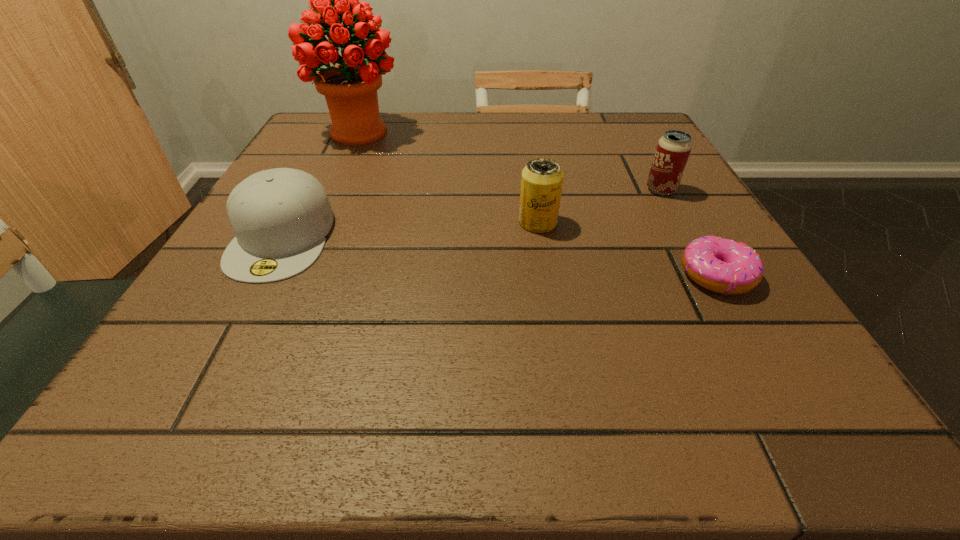
Locate an element on the screen. bouquet is located at coordinates (350, 89).

You are a GUI agent. You are given a task and a screenshot of the screen. Output one action in this format:
    pyautogui.click(x=<x>, y=<y>)
    Task: Click on the farthest object
    The image size is (960, 540).
    Given the screenshot: What is the action you would take?
    pyautogui.click(x=350, y=89)

Locate an element on the screen. Image resolution: width=960 pixels, height=540 pixels. the third object from left to right is located at coordinates (542, 179).

I want to click on the nearer beer can, so click(x=542, y=179).

Find the location of `the fourth nearest object`. the fourth nearest object is located at coordinates (673, 149).

Identify the location of the right beer can. (673, 149).

Locate an element on the screen. The width and height of the screenshot is (960, 540). cap is located at coordinates (280, 217).

This screenshot has width=960, height=540. In order to click on doughnut in this screenshot , I will do `click(723, 266)`.

Image resolution: width=960 pixels, height=540 pixels. In order to click on vacant area located 0.110m on the front of the tallest object in this screenshot , I will do pyautogui.click(x=338, y=178).

What are the coordinates of `free space located on the front of the nearer beer can` in the screenshot? It's located at (546, 273).